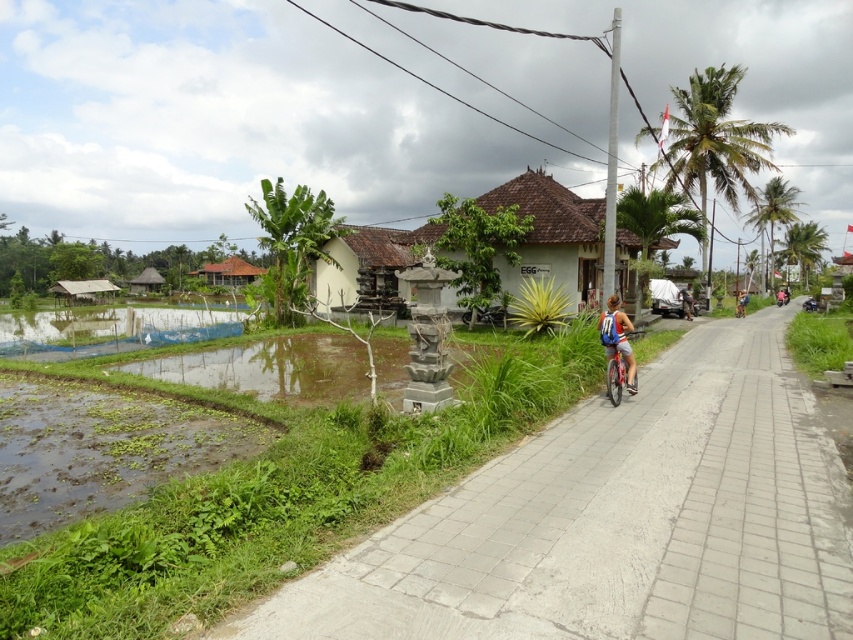
Between point (683, 548) and point (332, 300), which one is positioned in front?

Positioned in front is point (683, 548).

What do you see at coordinates (618, 522) in the screenshot? The width and height of the screenshot is (853, 640). I see `gray concrete path at center` at bounding box center [618, 522].

Where is `gray concrete path at center`? The height and width of the screenshot is (640, 853). gray concrete path at center is located at coordinates (618, 522).

The width and height of the screenshot is (853, 640). What do you see at coordinates (550, 230) in the screenshot?
I see `white stucco hut at center` at bounding box center [550, 230].

Who is more forward, (581, 252) or (151, 289)?

Positioned in front is point (581, 252).

Identify the location of white stucco hut at center. This screenshot has height=640, width=853. (550, 230).

Who is taller, brown thatched hut at lower left or thatched straw hut at left?

With more height is thatched straw hut at left.

Does brown thatched hut at lower left appear on the left side of thatched straw hut at left?

No, brown thatched hut at lower left is not to the left of thatched straw hut at left.

Measure the distance between brown thatched hut at lower left and camera.

A distance of 67.09 meters exists between brown thatched hut at lower left and camera.

The width and height of the screenshot is (853, 640). I want to click on brown thatched hut at lower left, so click(83, 289).